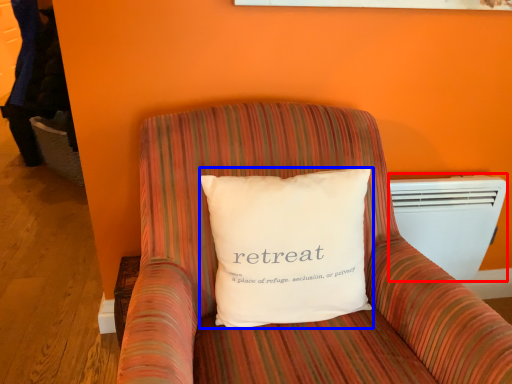
Question: Which object appears closest to the camera in this image, air conditioning (highlighted by a red box) or pillow (highlighted by a blue box)?

Choices:
 (A) air conditioning
 (B) pillow

Answer: (B)